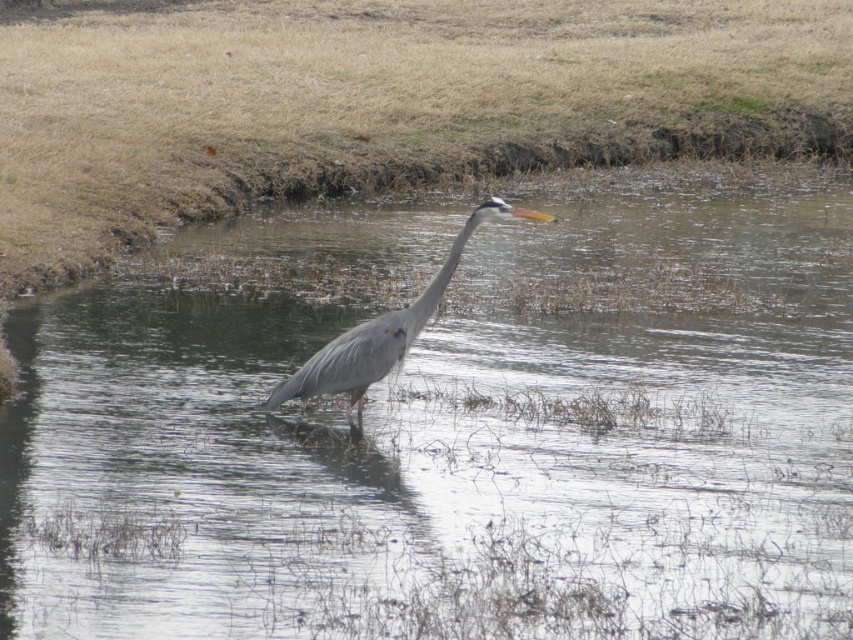
Is dry grass at upper center bigger than gray matte heron at center?

Yes.

What do you see at coordinates (376, 100) in the screenshot?
I see `dry grass at upper center` at bounding box center [376, 100].

At what (x,y) coordinates should I click in order to perform the action: click on dry grass at upper center. Please return your answer as a coordinate pair (x, y). Looking at the image, I should click on (376, 100).